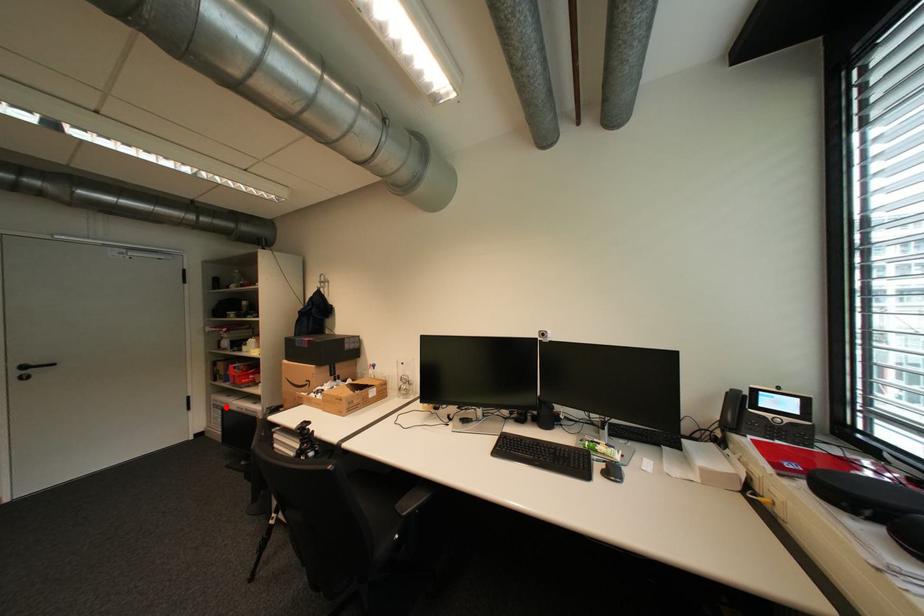
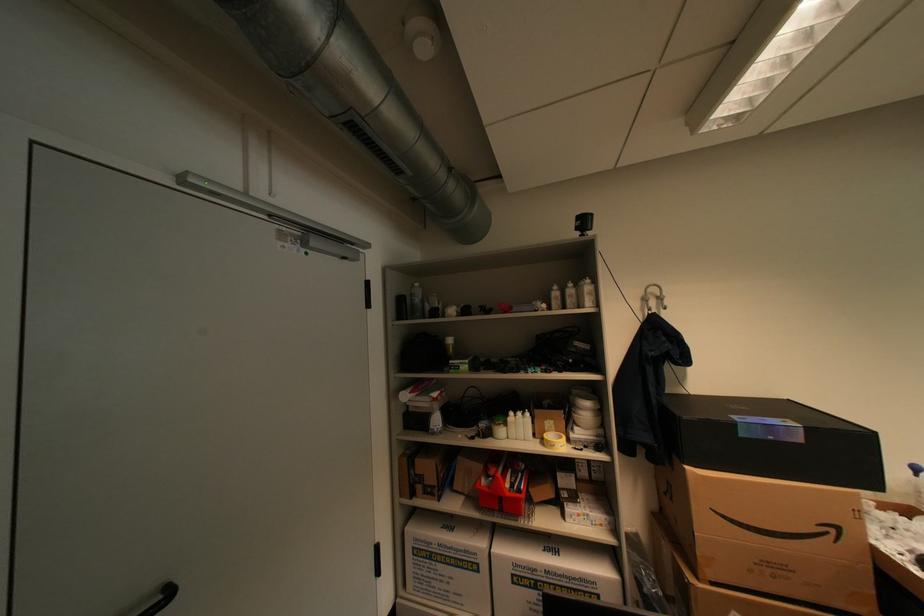
Question: I am providing you with two images of the same scene from different viewpoints. A red point is marked on the first image. At the location where the point appears in image 1, is it still visible in image 2?

Choices:
 (A) Yes
 (B) No

Answer: (A)